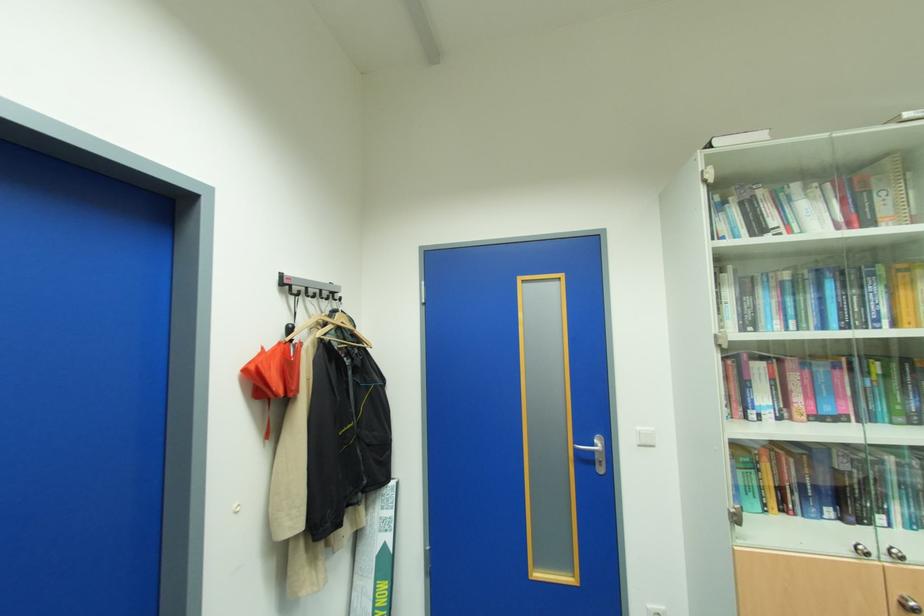
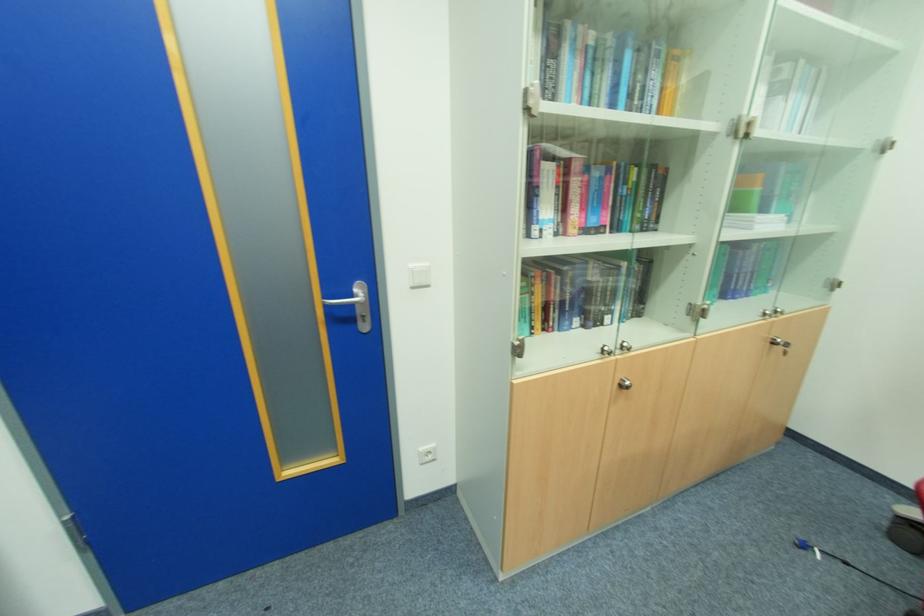
The images are taken continuously from a first-person perspective. In which direction is your viewpoint rotating?

The camera rotated toward right-down.